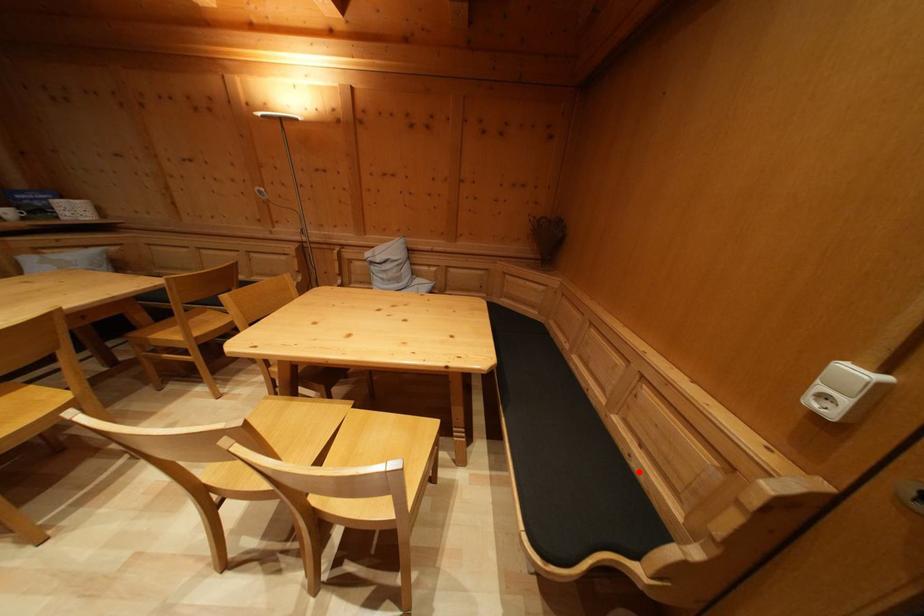
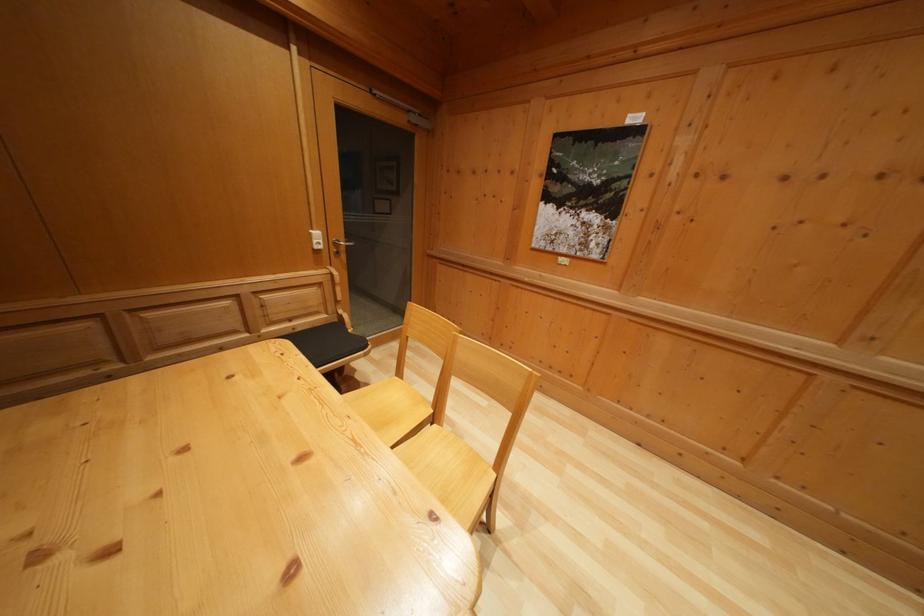
Locate, in the second image, the point that corresponds to the highlighted location in the first image.

(305, 336)